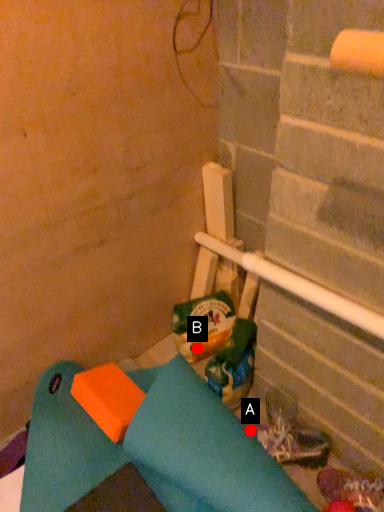
Question: Two points are circled on the image, labeled by A and B beside each circle. Which point is farther from the camera taking this photo?

Choices:
 (A) A is further
 (B) B is further

Answer: (B)